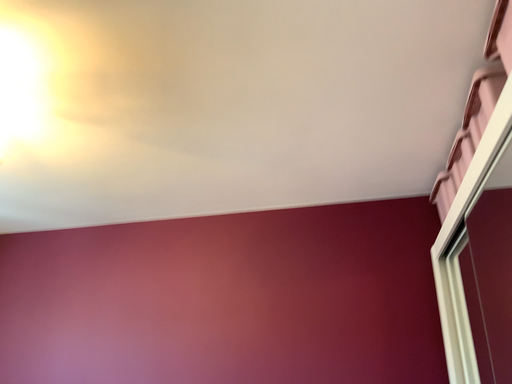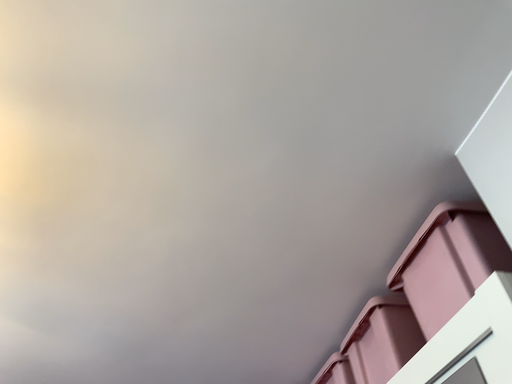
Question: How did the camera likely rotate when shooting the video?

Choices:
 (A) rotated upward
 (B) rotated downward

Answer: (A)